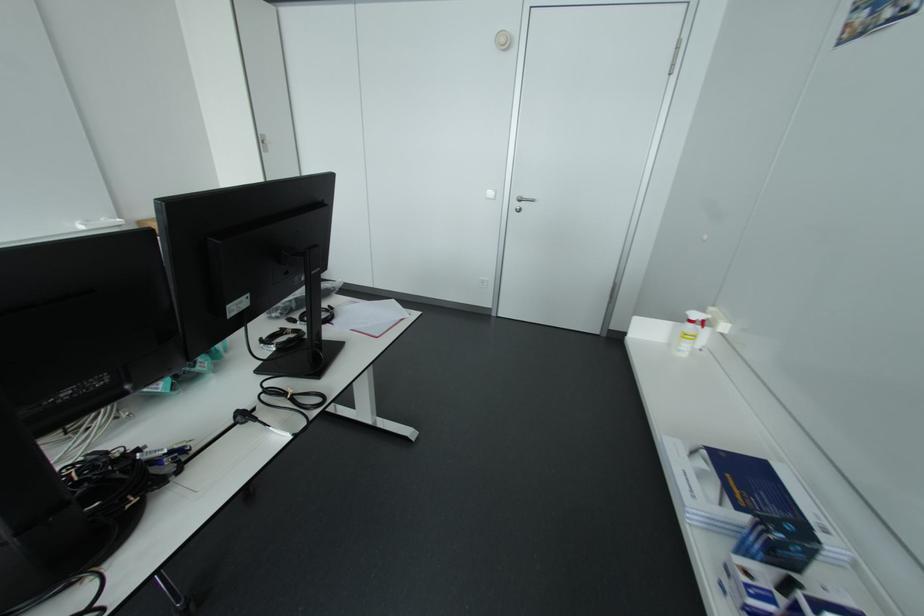
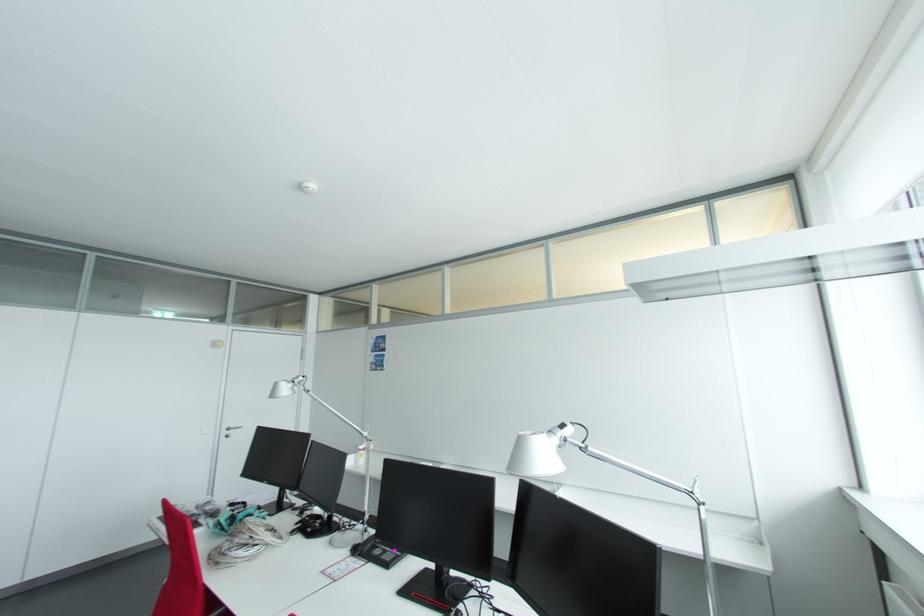
The point at (524, 201) is marked in the first image. Where is the corresponding point in the second image?

(232, 430)